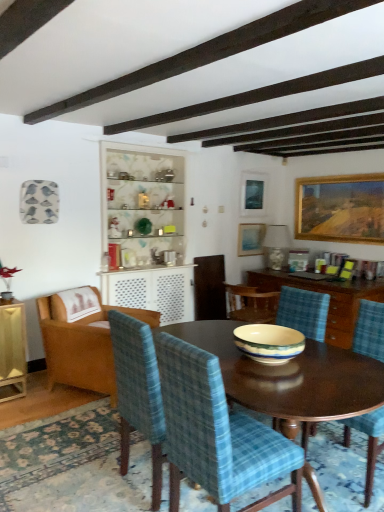
At what (x,y) coordinates should I click in order to perform the action: click on vacant space in front of porcelain bowl at center. Please return your answer as a coordinate pair (x, y). Looking at the image, I should click on (285, 383).